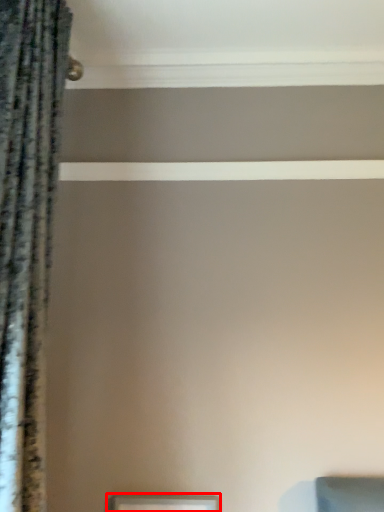
Question: From the image's perspective, considering the relative positions of picture frame (annotated by the red box) and curtain in the image provided, where is picture frame (annotated by the red box) located with respect to the staircase?

Choices:
 (A) below
 (B) above

Answer: (A)